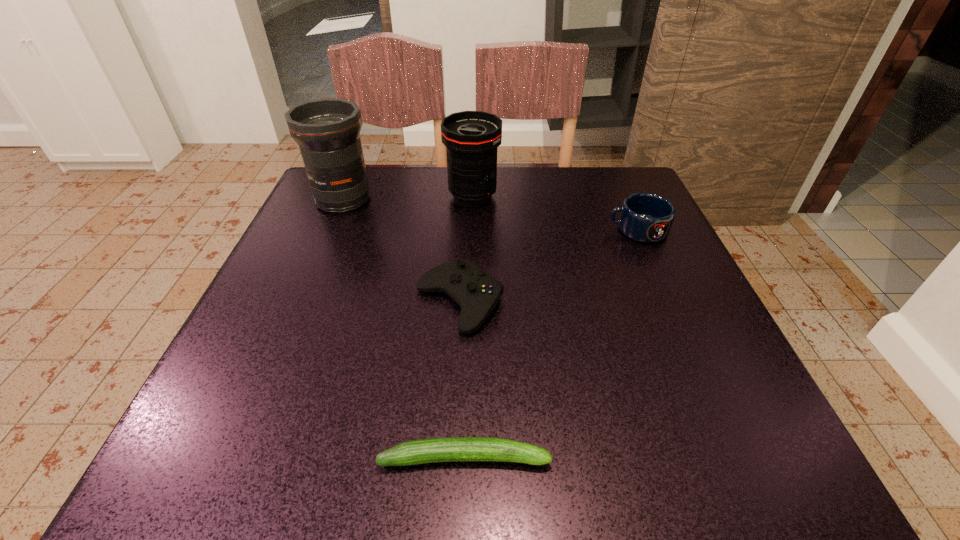
The width and height of the screenshot is (960, 540). Find the location of `object that is at the far left corner`. object that is at the far left corner is located at coordinates (327, 130).

You are a GUI agent. You are given a task and a screenshot of the screen. Output one action in this format:
    pyautogui.click(x=<x>, y=<y>)
    Task: Click on the object that is at the far right corner
    The image size is (960, 540).
    Given the screenshot: What is the action you would take?
    pyautogui.click(x=645, y=217)

Find the location of a particular element. blank space at the far edge is located at coordinates (507, 171).

Find the location of `free region at the left edge of the desktop`. free region at the left edge of the desktop is located at coordinates (259, 354).

The image size is (960, 540). In the image, there is a desktop. Identify the location of vacant space at the right edge. (674, 261).

In the image, there is a desktop. At what (x,y) coordinates should I click in order to perform the action: click on free space at the near left corner. Please return your answer as a coordinate pair (x, y). Looking at the image, I should click on (174, 475).

This screenshot has height=540, width=960. In the image, there is a desktop. Identify the location of vacant space at the far right corner. (589, 218).

Locate an element on the screen. Image resolution: width=960 pixels, height=540 pixels. free space at the near right corner of the desktop is located at coordinates (763, 438).

Where is `free spot between the leftmost object and the control`? The width and height of the screenshot is (960, 540). free spot between the leftmost object and the control is located at coordinates (401, 252).

Locate an element on the screen. The image size is (960, 540). vacant space that's between the shorter telephoto lens and the leftmost object is located at coordinates (408, 198).